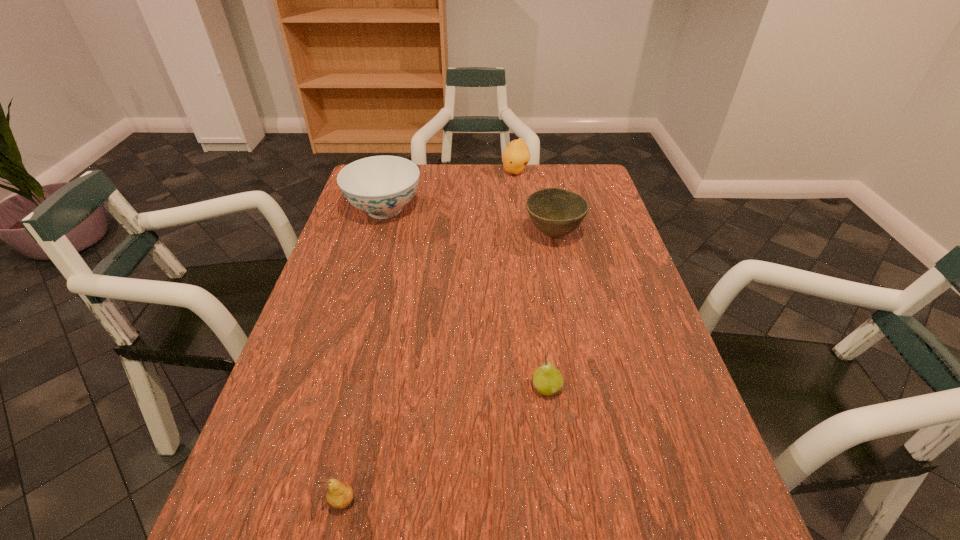
I want to click on free region located 0.080m on the right of the second farthest pear, so click(601, 388).

Where is `free space located on the back of the nearest object`? This screenshot has width=960, height=540. free space located on the back of the nearest object is located at coordinates (367, 392).

The image size is (960, 540). I want to click on pear that is at the far edge, so click(x=516, y=155).

In order to click on chinaware located in the far edge section of the desktop in this screenshot , I will do `click(381, 186)`.

At what (x,y) coordinates should I click in order to perform the action: click on chinaware present at the left edge. Please return your answer as a coordinate pair (x, y). The image size is (960, 540). Looking at the image, I should click on (381, 186).

Locate an element on the screen. The height and width of the screenshot is (540, 960). pear that is at the left edge is located at coordinates (340, 495).

Identify the location of object located in the right edge section of the desktop. Image resolution: width=960 pixels, height=540 pixels. (556, 212).

I want to click on object that is positioned at the far left corner, so click(381, 186).

Identify the location of free space at the far edge of the desktop. (439, 181).

The image size is (960, 540). I want to click on vacant space at the left edge, so click(x=386, y=235).